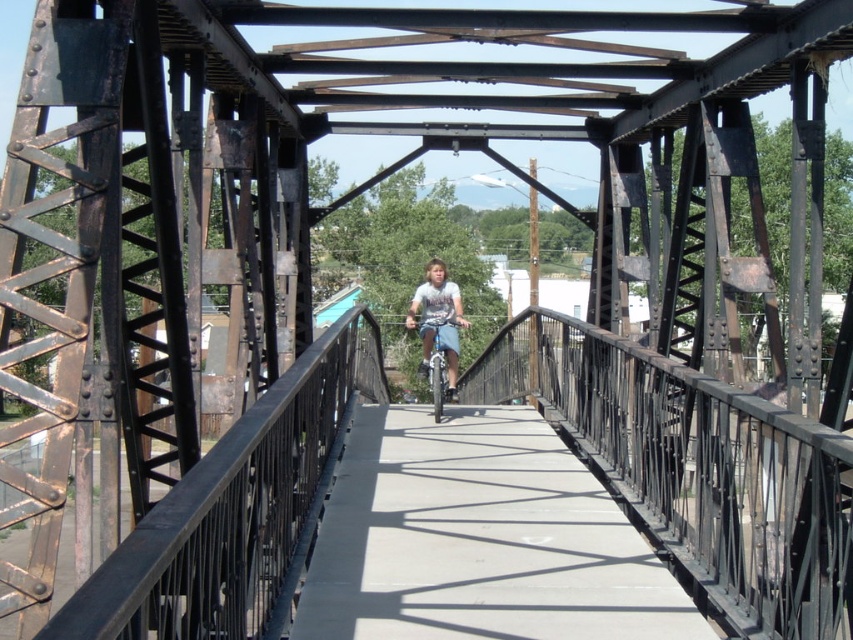
You are a cyclist approaching the metal truss bridge. You notice the white concrete path at center and the light blue denim shorts at center. Which object is lower in height?

The white concrete path at center has a lesser height compared to the light blue denim shorts at center, so the white concrete path at center is lower in height.

You are standing on the metal truss bridge and want to reach a specific point marked at coordinates point [537,556]. If you can walk 1.2 meters per second, how long will it take you to reach that point from your current position?

The distance of point [537,556] from viewer is 5.84 meters. At a walking speed of 1.2 meters per second, it would take approximately 4.87 seconds to reach the point.